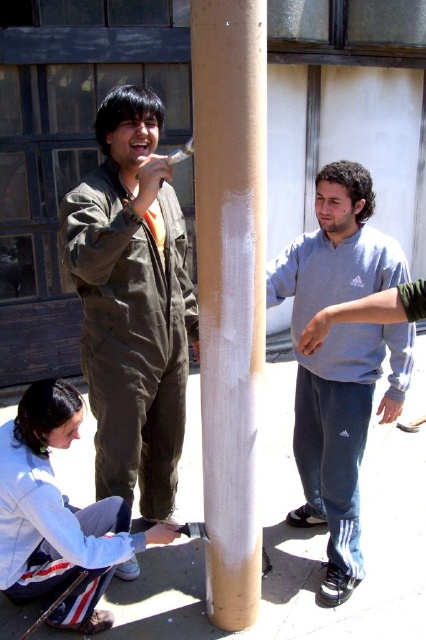
You are a photographer trying to capture the scene of the three painters working on the pillar. You want to ensure that both points mentioned in the image are visible in your photo. Given that point 1 is at coordinate (235,76) and point 2 is at (150,410), which point is closer to the camera lens to help frame the shot properly?

Point (235,76) is closer to the viewer than point (150,410), so it will appear larger and more prominent in the photo.

Based on the scene, which object is taller between the smooth brown pole at center and the matte green jumpsuit at center?

The smooth brown pole at center is taller than the matte green jumpsuit at center.